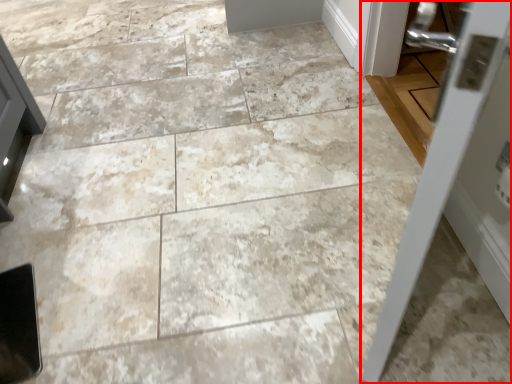
Question: From the image's perspective, what is the correct spatial positioning of door (annotated by the red box) in reference to door?

Choices:
 (A) below
 (B) above

Answer: (A)